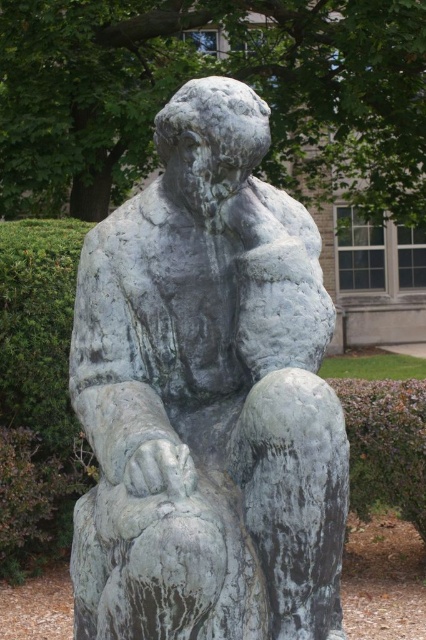
You are a landscape architect designing a new garden layout. You need to place a new water feature exactly 0.5 meters to the right of the green patina stone statue at center. Based on the image, where should you position the water feature relative to the statue?

The water feature should be placed 0.5 meters to the right of the green patina stone statue at center, as specified in the design requirements.

From the picture: You are a landscape architect designing a garden pathway. You need to place a bench so that it is equidistant from both the green patina stone statue at center and the green leafy hedge at lower right. Given their relative sizes, which object should the bench be closer to?

The bench should be closer to the green leafy hedge at lower right because the green patina stone statue at center is much taller, meaning it occupies more vertical space and thus requires a greater distance to maintain equal proportionate distance.

You are a landscape architect designing a garden pathway that must pass between the green patina stone statue at center and the green leafy hedge at lower right. Based on the scene description, which object should the path go around to maintain a clear view of the statue?

The path should go around the green leafy hedge at lower right because the green patina stone statue at center is positioned over it, meaning the hedge is behind the statue and the statue should remain visible from the front.